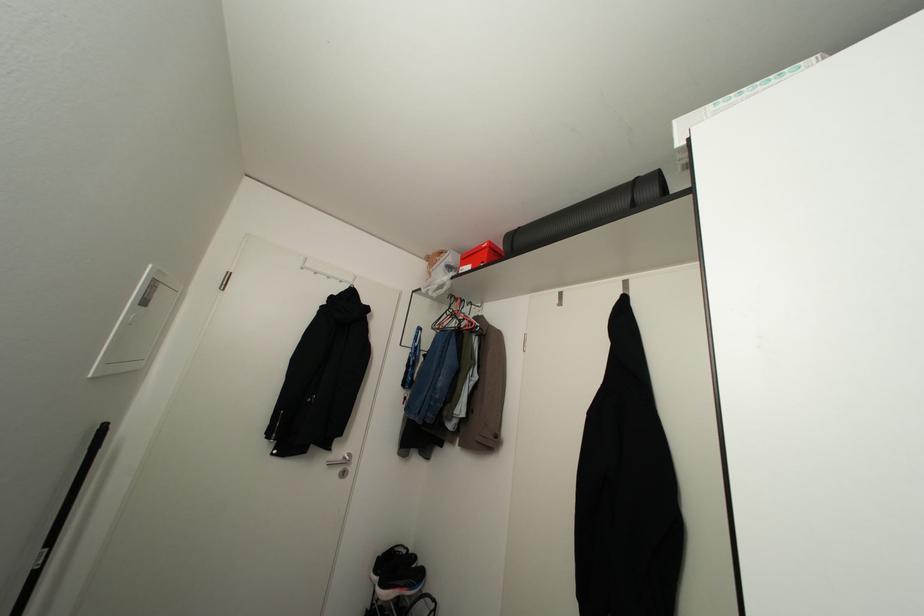
I want to click on white panel latch, so click(138, 325).